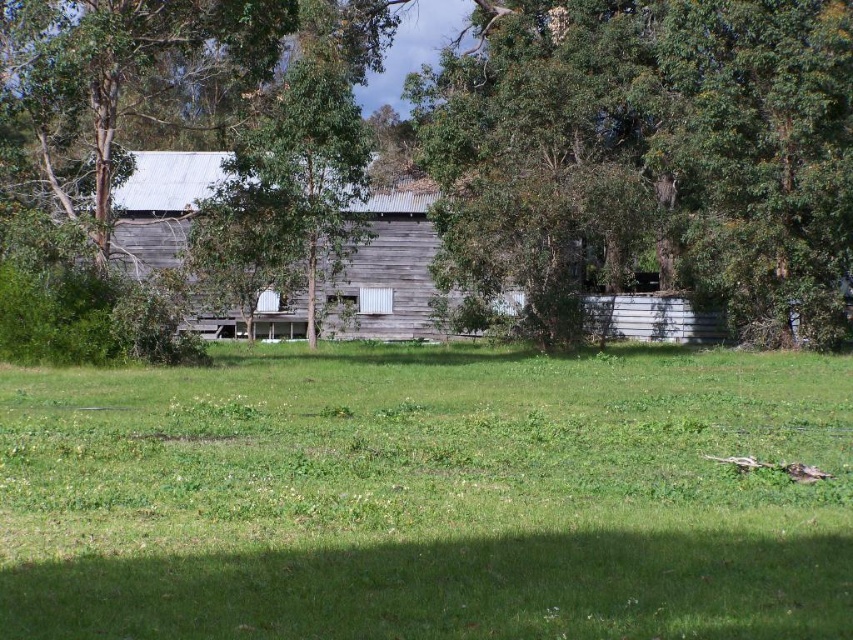
You are standing at the point marked as point (x=427, y=496) in the rural scene. What is the immediate surface beneath your feet?

The immediate surface beneath your feet at point (x=427, y=496) is green grass at center.